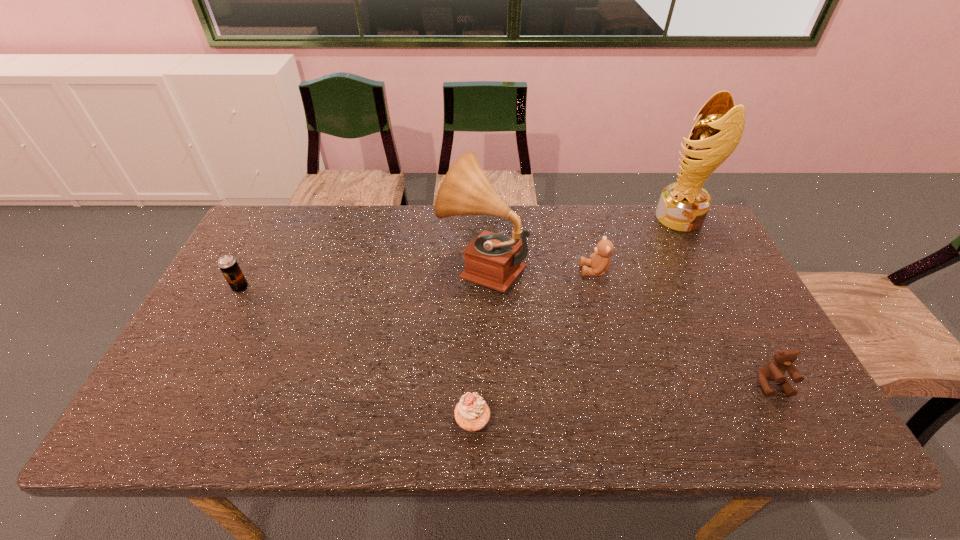
This screenshot has height=540, width=960. I want to click on vacant space located on the face of the nearer teddy bear, so pos(802,440).

Identify the location of vacant region located 0.070m on the right of the cupcake. The height and width of the screenshot is (540, 960). (522, 421).

At what (x,y) coordinates should I click in order to perform the action: click on award positioned at the far edge. Please return your answer as a coordinate pair (x, y). The height and width of the screenshot is (540, 960). Looking at the image, I should click on (683, 205).

I want to click on phonograph record that is at the far edge, so click(x=492, y=260).

Where is `object at the near edge`? object at the near edge is located at coordinates (472, 413).

The width and height of the screenshot is (960, 540). In order to click on object at the left edge in this screenshot , I will do `click(228, 265)`.

Locate an element on the screen. Image resolution: width=960 pixels, height=540 pixels. award located at the right edge is located at coordinates (683, 205).

You are a GUI agent. You are given a task and a screenshot of the screen. Output one action in this format:
    pyautogui.click(x=<x>, y=<y>)
    Task: Click on the teddy bear located in the right edge section of the desktop
    
    Given the screenshot: What is the action you would take?
    pyautogui.click(x=774, y=370)

Find the location of a particular element. object at the far right corner is located at coordinates (683, 205).

The height and width of the screenshot is (540, 960). What are the coordinates of `vacant space at the far edge of the desktop` in the screenshot? It's located at (626, 247).